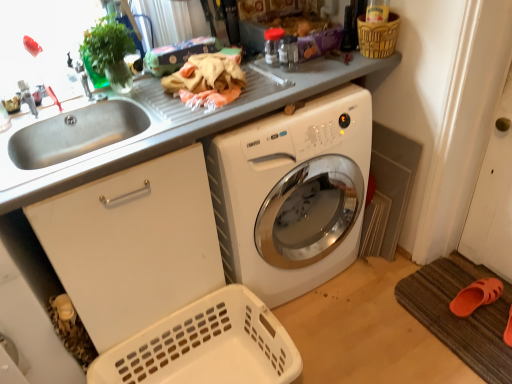
Question: Does brown woven basket at upper right, which ranks as the 1th basket in top-to-bottom order, have a larger size compared to stainless steel sink at left?

Choices:
 (A) yes
 (B) no

Answer: (B)

Question: From a real-world perspective, is brown woven basket at upper right, which ranks as the second basket in bottom-to-top order, over stainless steel sink at left?

Choices:
 (A) yes
 (B) no

Answer: (A)

Question: Does brown woven basket at upper right, which is counted as the 1th basket, starting from the right, lie in front of stainless steel sink at left?

Choices:
 (A) yes
 (B) no

Answer: (B)

Question: Considering the relative positions of brown woven basket at upper right, which ranks as the second basket in bottom-to-top order, and stainless steel sink at left in the image provided, is brown woven basket at upper right, which ranks as the second basket in bottom-to-top order, behind stainless steel sink at left?

Choices:
 (A) no
 (B) yes

Answer: (B)

Question: From the image's perspective, would you say brown woven basket at upper right, which ranks as the second basket in bottom-to-top order, is positioned over stainless steel sink at left?

Choices:
 (A) yes
 (B) no

Answer: (A)

Question: Is brushed metal faucet at upper left directly adjacent to stainless steel sink at left?

Choices:
 (A) yes
 (B) no

Answer: (B)

Question: Is stainless steel sink at left located within brushed metal faucet at upper left?

Choices:
 (A) yes
 (B) no

Answer: (B)

Question: From the image's perspective, is brushed metal faucet at upper left on top of stainless steel sink at left?

Choices:
 (A) no
 (B) yes

Answer: (B)

Question: Can you confirm if brushed metal faucet at upper left is smaller than stainless steel sink at left?

Choices:
 (A) no
 (B) yes

Answer: (B)

Question: Can you confirm if brushed metal faucet at upper left is bigger than stainless steel sink at left?

Choices:
 (A) no
 (B) yes

Answer: (A)

Question: Could you tell me if brushed metal faucet at upper left is facing stainless steel sink at left?

Choices:
 (A) yes
 (B) no

Answer: (B)

Question: Does brushed metal faucet at upper left have a lesser height compared to white glossy washing machine at center?

Choices:
 (A) no
 (B) yes

Answer: (B)